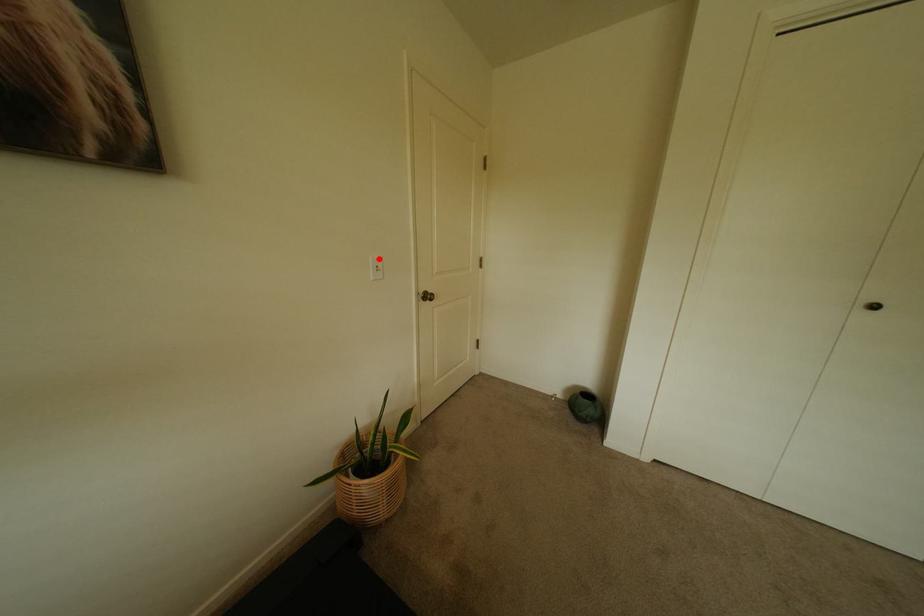
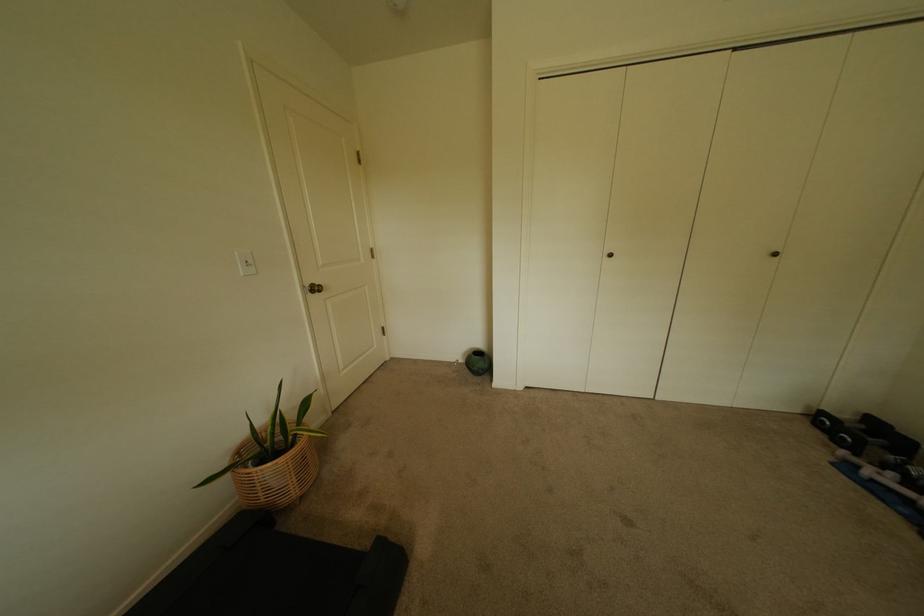
The point at the highlighted location is marked in the first image. Where is the corresponding point in the second image?

(245, 254)